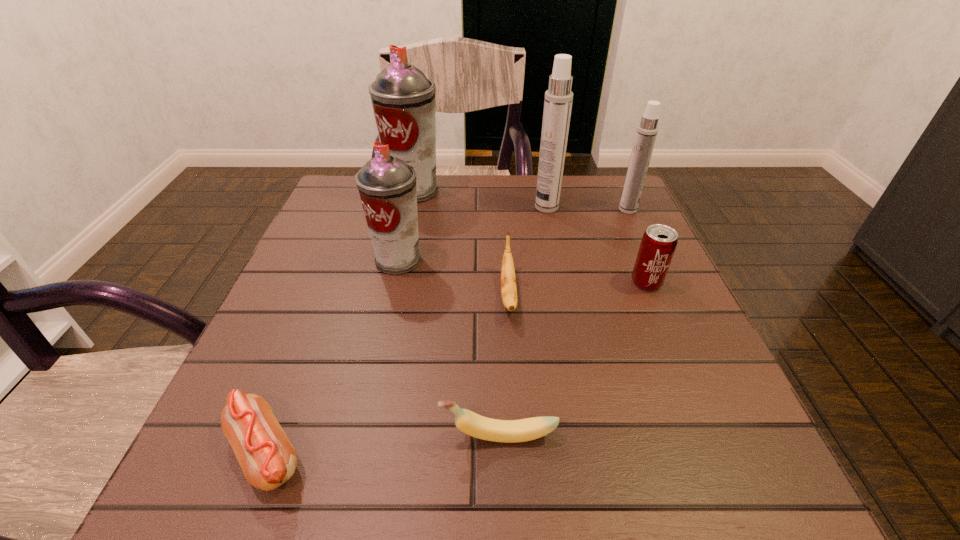
Where is `the farther gray aerosol can`? the farther gray aerosol can is located at coordinates (403, 99).

This screenshot has height=540, width=960. Find the location of `the third aerosol can from left to right`. the third aerosol can from left to right is located at coordinates (558, 99).

At what (x,y) coordinates should I click in order to perform the action: click on the bigger white aerosol can. Please return your answer as a coordinate pair (x, y). Looking at the image, I should click on (558, 99).

At what (x,y) coordinates should I click in order to perform the action: click on the smaller white aerosol can. Please return your answer as a coordinate pair (x, y). Looking at the image, I should click on (647, 130).

At what (x,y) coordinates should I click in order to perform the action: click on the rightmost aerosol can. Please return your answer as a coordinate pair (x, y). Image resolution: width=960 pixels, height=540 pixels. Looking at the image, I should click on (647, 130).

Find the location of a particular element. The width and height of the screenshot is (960, 540). the smaller gray aerosol can is located at coordinates (387, 186).

Where is `the nearest aerosol can`? Image resolution: width=960 pixels, height=540 pixels. the nearest aerosol can is located at coordinates (387, 186).

Find the location of `beer can`. beer can is located at coordinates (658, 244).

The height and width of the screenshot is (540, 960). I want to click on the farther yellow banana, so click(x=508, y=280).

This screenshot has width=960, height=540. I want to click on the nearer banana, so click(507, 431).